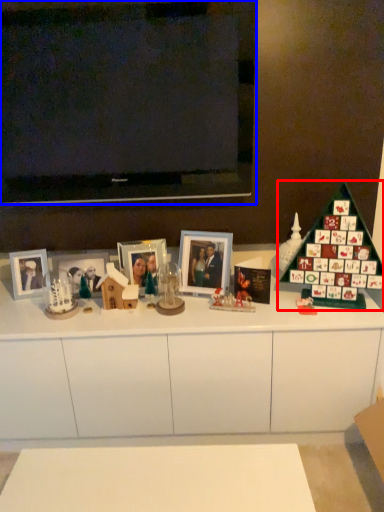
Question: Which object is further to the camera taking this photo, christmas tree (highlighted by a red box) or television (highlighted by a blue box)?

Choices:
 (A) christmas tree
 (B) television

Answer: (B)